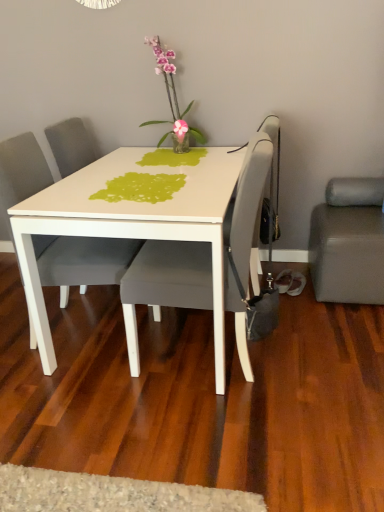
The width and height of the screenshot is (384, 512). In order to click on matte gray chair at center, the first chair viewed from the left in this screenshot , I will do `click(82, 261)`.

At what (x,y) coordinates should I click in order to perform the action: click on matte gray chair at center, which is counted as the first chair, starting from the right. Please return your answer as a coordinate pair (x, y). Looking at the image, I should click on (165, 283).

Consider the image. Are matte gray chair at center, which appears as the 2th chair when viewed from the right, and translucent glass vase at upper center far apart?

No, there isn't a large distance between matte gray chair at center, which appears as the 2th chair when viewed from the right, and translucent glass vase at upper center.

From the picture: From a real-world perspective, is matte gray chair at center, the first chair viewed from the left, beneath translucent glass vase at upper center?

Correct, in the physical world, matte gray chair at center, the first chair viewed from the left, is lower than translucent glass vase at upper center.

Does point (89, 241) appear closer or farther from the camera than point (153, 121)?

Point (89, 241).

Is the depth of matte gray chair at center, which appears as the 2th chair when viewed from the right, greater than that of translucent glass vase at upper center?

That is False.

What's the angular difference between translucent glass vase at upper center and matte gray chair at center, which appears as the 2th chair when viewed from the right,'s facing directions?

The facing directions of translucent glass vase at upper center and matte gray chair at center, which appears as the 2th chair when viewed from the right, are 90 degrees apart.

Measure the distance between translucent glass vase at upper center and matte gray chair at center, which appears as the 2th chair when viewed from the right.

The distance of translucent glass vase at upper center from matte gray chair at center, which appears as the 2th chair when viewed from the right, is 31.90 inches.

Where is `houseplant located above the matte gray chair at center, the first chair viewed from the left (from a real-world perspective)`? houseplant located above the matte gray chair at center, the first chair viewed from the left (from a real-world perspective) is located at coordinates (174, 99).

In the scene shown: Relative to matte gray chair at center, which appears as the 2th chair when viewed from the right, is translucent glass vase at upper center in front or behind?

Clearly, translucent glass vase at upper center is behind matte gray chair at center, which appears as the 2th chair when viewed from the right.

Can you tell me how much matte gray chair at center, the 2th chair in the left-to-right sequence, and suede gray studio couch at lower right differ in facing direction?

The facing directions of matte gray chair at center, the 2th chair in the left-to-right sequence, and suede gray studio couch at lower right are 90 degrees apart.

Identify the location of studio couch located on the right of matte gray chair at center, which is counted as the first chair, starting from the right. (348, 242).

Between matte gray chair at center, the 2th chair in the left-to-right sequence, and suede gray studio couch at lower right, which one has larger size?

matte gray chair at center, the 2th chair in the left-to-right sequence, is bigger.

Which is behind, matte gray chair at center, the 2th chair in the left-to-right sequence, or suede gray studio couch at lower right?

suede gray studio couch at lower right is further away from the camera.

Is suede gray studio couch at lower right next to matte gray chair at center, the 2th chair in the left-to-right sequence, and touching it?

No, suede gray studio couch at lower right is not touching matte gray chair at center, the 2th chair in the left-to-right sequence.

Is suede gray studio couch at lower right positioned before matte gray chair at center, the 2th chair in the left-to-right sequence?

No, the depth of suede gray studio couch at lower right is greater than that of matte gray chair at center, the 2th chair in the left-to-right sequence.

Is suede gray studio couch at lower right to the right of matte gray chair at center, the 2th chair in the left-to-right sequence, from the viewer's perspective?

Indeed, suede gray studio couch at lower right is positioned on the right side of matte gray chair at center, the 2th chair in the left-to-right sequence.

Between suede gray studio couch at lower right and matte gray chair at center, the first chair viewed from the left, which one has larger width?

With larger width is matte gray chair at center, the first chair viewed from the left.

Between suede gray studio couch at lower right and matte gray chair at center, which appears as the 2th chair when viewed from the right, which one appears on the left side from the viewer's perspective?

Positioned to the left is matte gray chair at center, which appears as the 2th chair when viewed from the right.

How distant is suede gray studio couch at lower right from matte gray chair at center, the first chair viewed from the left?

Result: A distance of 3.92 feet exists between suede gray studio couch at lower right and matte gray chair at center, the first chair viewed from the left.

Would you consider suede gray studio couch at lower right to be distant from matte gray chair at center, which appears as the 2th chair when viewed from the right?

Yes, suede gray studio couch at lower right and matte gray chair at center, which appears as the 2th chair when viewed from the right, are located far from each other.

Measure the distance from matte gray chair at center, which appears as the 2th chair when viewed from the right, to matte gray chair at center, the 2th chair in the left-to-right sequence.

matte gray chair at center, which appears as the 2th chair when viewed from the right, and matte gray chair at center, the 2th chair in the left-to-right sequence, are 15.09 inches apart from each other.

Can you confirm if matte gray chair at center, which appears as the 2th chair when viewed from the right, is smaller than matte gray chair at center, the 2th chair in the left-to-right sequence?

Indeed, matte gray chair at center, which appears as the 2th chair when viewed from the right, has a smaller size compared to matte gray chair at center, the 2th chair in the left-to-right sequence.

Between matte gray chair at center, the first chair viewed from the left, and matte gray chair at center, which is counted as the first chair, starting from the right, which one is positioned in front?

matte gray chair at center, which is counted as the first chair, starting from the right.

Considering the relative sizes of matte gray chair at center, the first chair viewed from the left, and matte gray chair at center, which is counted as the first chair, starting from the right, in the image provided, is matte gray chair at center, the first chair viewed from the left, thinner than matte gray chair at center, which is counted as the first chair, starting from the right,?

Yes, matte gray chair at center, the first chair viewed from the left, is thinner than matte gray chair at center, which is counted as the first chair, starting from the right.

From the image's perspective, which one is positioned higher, translucent glass vase at upper center or suede gray studio couch at lower right?

translucent glass vase at upper center.

How different are the orientations of translucent glass vase at upper center and suede gray studio couch at lower right in degrees?

There is a 6.2e-05-degree angle between the facing directions of translucent glass vase at upper center and suede gray studio couch at lower right.

Is translucent glass vase at upper center next to suede gray studio couch at lower right and touching it?

translucent glass vase at upper center and suede gray studio couch at lower right are clearly separated.

Do you think translucent glass vase at upper center is within suede gray studio couch at lower right, or outside of it?

translucent glass vase at upper center is not enclosed by suede gray studio couch at lower right.

Where is `houseplant that is behind the matte gray chair at center, which appears as the 2th chair when viewed from the right`? houseplant that is behind the matte gray chair at center, which appears as the 2th chair when viewed from the right is located at coordinates (174, 99).

Identify the location of the 1st chair below the translucent glass vase at upper center (from the image's perspective). (82, 261).

Estimate the real-world distances between objects in this image. Which object is further from matte gray chair at center, the first chair viewed from the left, translucent glass vase at upper center or matte gray chair at center, the 2th chair in the left-to-right sequence?

Among the two, translucent glass vase at upper center is located further to matte gray chair at center, the first chair viewed from the left.

From the picture: When comparing their distances from matte gray chair at center, which is counted as the first chair, starting from the right, does suede gray studio couch at lower right or matte gray chair at center, which appears as the 2th chair when viewed from the right, seem closer?

matte gray chair at center, which appears as the 2th chair when viewed from the right, is positioned closer to the anchor matte gray chair at center, which is counted as the first chair, starting from the right.

Considering their positions, is matte gray chair at center, the 2th chair in the left-to-right sequence, positioned further to suede gray studio couch at lower right than matte gray chair at center, the first chair viewed from the left?

matte gray chair at center, the first chair viewed from the left, is positioned further to the anchor suede gray studio couch at lower right.

Which object lies further to the anchor point suede gray studio couch at lower right, matte gray chair at center, which is counted as the first chair, starting from the right, or translucent glass vase at upper center?

translucent glass vase at upper center is further to suede gray studio couch at lower right.

Estimate the real-world distances between objects in this image. Which object is closer to translucent glass vase at upper center, matte gray chair at center, which appears as the 2th chair when viewed from the right, or matte gray chair at center, which is counted as the first chair, starting from the right?

Among the two, matte gray chair at center, which appears as the 2th chair when viewed from the right, is located nearer to translucent glass vase at upper center.

Estimate the real-world distances between objects in this image. Which object is further from matte gray chair at center, which appears as the 2th chair when viewed from the right, suede gray studio couch at lower right or translucent glass vase at upper center?

suede gray studio couch at lower right is positioned further to the anchor matte gray chair at center, which appears as the 2th chair when viewed from the right.

Looking at the image, which one is located further to matte gray chair at center, which is counted as the first chair, starting from the right, translucent glass vase at upper center or matte gray chair at center, which appears as the 2th chair when viewed from the right?

translucent glass vase at upper center is positioned further to the anchor matte gray chair at center, which is counted as the first chair, starting from the right.

Which object lies further to the anchor point translucent glass vase at upper center, matte gray chair at center, which is counted as the first chair, starting from the right, or suede gray studio couch at lower right?

suede gray studio couch at lower right.

I want to click on chair between translucent glass vase at upper center and suede gray studio couch at lower right from left to right, so click(x=165, y=283).

At what (x,y) coordinates should I click in order to perform the action: click on houseplant located between matte gray chair at center, the first chair viewed from the left, and suede gray studio couch at lower right in the left-right direction. Please return your answer as a coordinate pair (x, y). This screenshot has width=384, height=512. Looking at the image, I should click on (174, 99).

Identify the location of chair situated between matte gray chair at center, which appears as the 2th chair when viewed from the right, and suede gray studio couch at lower right from left to right. (165, 283).

Identify the location of chair between translucent glass vase at upper center and matte gray chair at center, the 2th chair in the left-to-right sequence, vertically. The image size is (384, 512). (82, 261).